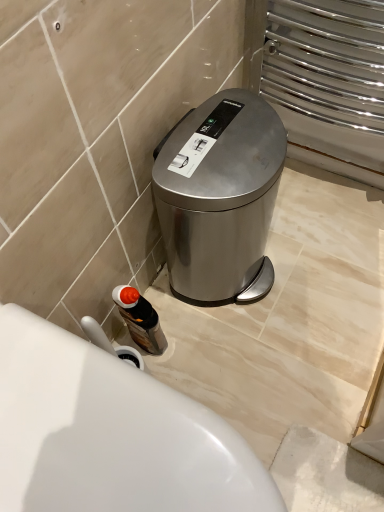
The height and width of the screenshot is (512, 384). Find the location of `vacant area on top of satin metallic trash can at lower right (from a real-world perspective)`. vacant area on top of satin metallic trash can at lower right (from a real-world perspective) is located at coordinates tap(216, 135).